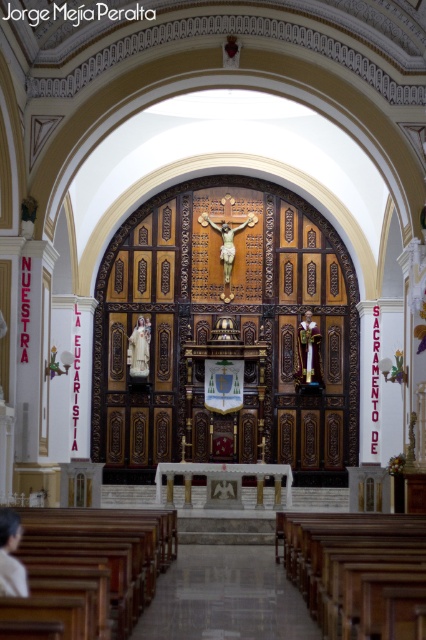
You are standing in the church and want to take a closer look at both the matte gold statue at center and the matte white statue at center. Which statue will appear closer to you when you first enter the altar area?

The matte gold statue at center will appear closer to you because it is positioned further to the viewer than the matte white statue at center.

You are standing at the camera position in the church. There is a smooth skin person at lower left. Can you see them from where you are standing?

The smooth skin person at lower left and camera are 90.07 feet apart. Since the distance is too far, you cannot see them clearly from the camera position.